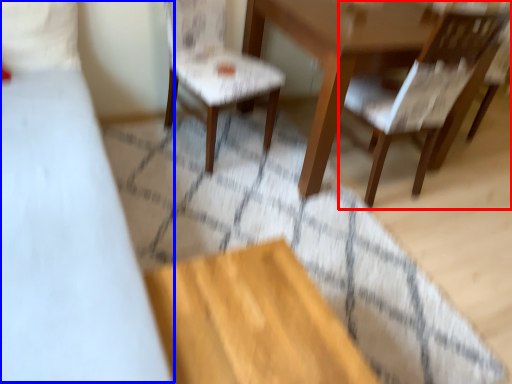
Question: Which point is closer to the camera, chair (highlighted by a red box) or bed (highlighted by a blue box)?

Choices:
 (A) chair
 (B) bed

Answer: (B)